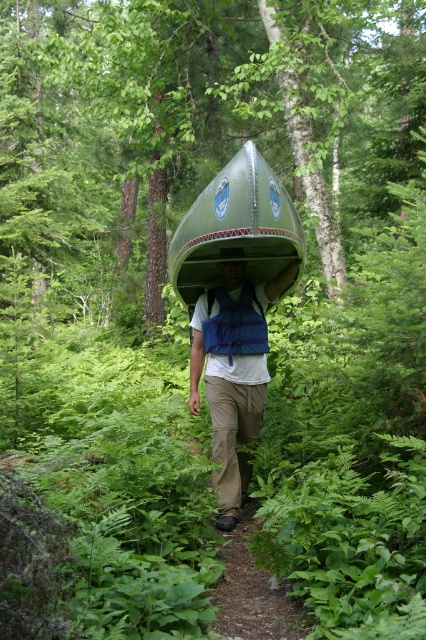
Based on the photo, you are standing on a forest path and see the matte green canoe at center. If you want to reach the canoe without moving closer, which direction should you look?

The matte green canoe at center is 4.86 meters away from viewer, so you should look straight ahead since it is positioned at the center of your view.

Consider the image. You are a hiker trying to navigate through the forest. You see a matte green canoe at center and a brown dirt path at center. Which object is higher in elevation?

The matte green canoe at center is taller than the brown dirt path at center, so the matte green canoe at center is higher in elevation.